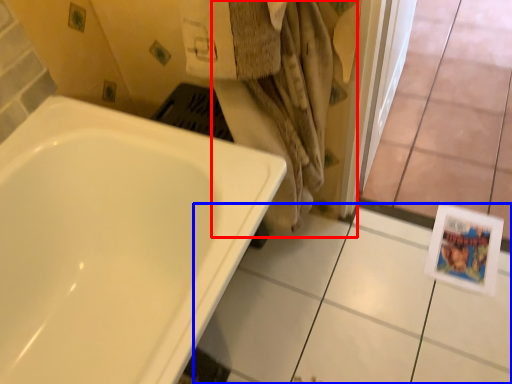
Question: Among these objects, which one is farthest to the camera, bath towel (highlighted by a red box) or ceramic tile (highlighted by a blue box)?

Choices:
 (A) bath towel
 (B) ceramic tile

Answer: (B)